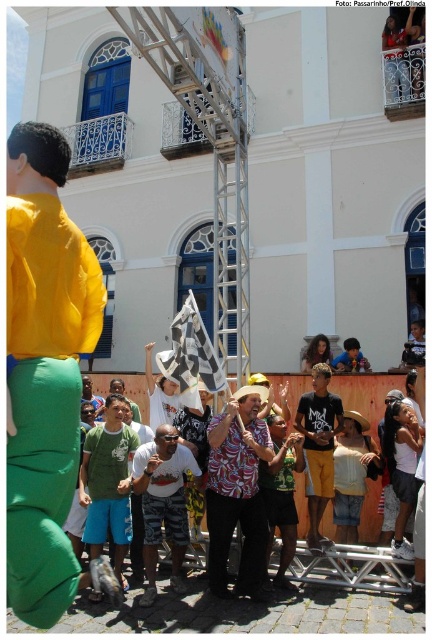
Question: Which object is closer to the camera taking this photo?

Choices:
 (A) checkered fabric flag at center
 (B) green matte shirt at center
 (C) dark blue cotton shirt at center

Answer: (B)

Question: Does dark blue cotton shirt at center have a greater width compared to checkered fabric flag at center?

Choices:
 (A) no
 (B) yes

Answer: (A)

Question: Which point is farther to the camera?

Choices:
 (A) pyautogui.click(x=247, y=452)
 (B) pyautogui.click(x=48, y=380)
 (C) pyautogui.click(x=121, y=394)
 (D) pyautogui.click(x=194, y=308)

Answer: (C)

Question: Is printed fabric shirt at center below green fabric shirt at center?

Choices:
 (A) no
 (B) yes

Answer: (B)

Question: Based on their relative distances, which object is nearer to the matte yellow jacket at left?

Choices:
 (A) printed fabric shirt at center
 (B) camouflage shorts at center

Answer: (B)

Question: Does green matte shirt at center appear on the right side of dark blue cotton shirt at center?

Choices:
 (A) no
 (B) yes

Answer: (A)